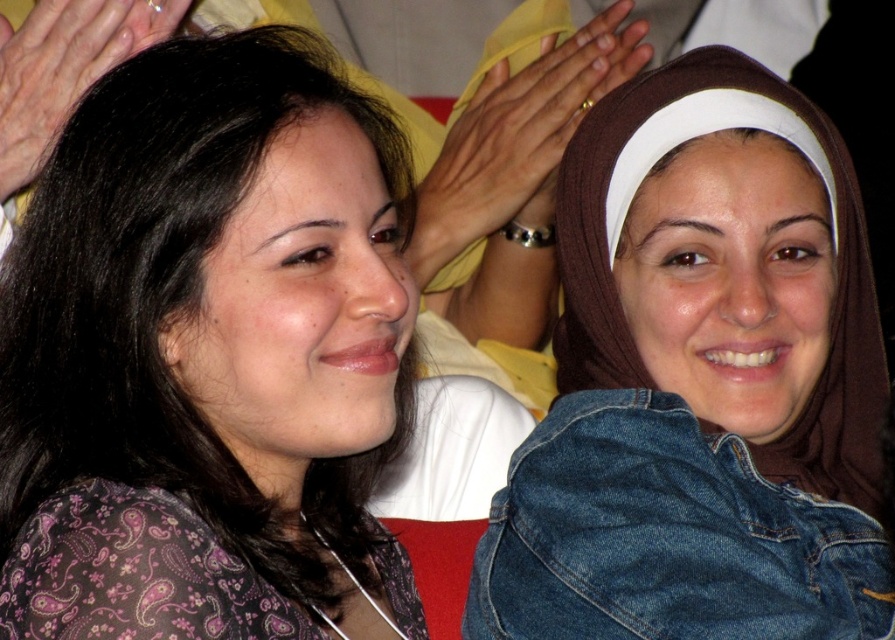
Question: Is paisley-patterned shirt at left to the left of metallic ring at upper center from the viewer's perspective?

Choices:
 (A) no
 (B) yes

Answer: (B)

Question: Can you confirm if brown denim jacket at upper right is positioned below paisley-patterned shirt at left?

Choices:
 (A) yes
 (B) no

Answer: (A)

Question: Which object is closer to the camera taking this photo?

Choices:
 (A) metallic ring at upper center
 (B) matte black hair at upper left
 (C) paisley-patterned shirt at left

Answer: (C)

Question: Which point is closer to the camera?

Choices:
 (A) (777, 564)
 (B) (109, 376)
 (C) (23, 115)
 (D) (424, 266)

Answer: (B)

Question: Does brown denim jacket at upper right appear under matte black hair at upper left?

Choices:
 (A) yes
 (B) no

Answer: (A)

Question: Which object is positioned closest to the brown denim jacket at upper right?

Choices:
 (A) metallic ring at upper center
 (B) matte black hair at upper left
 (C) paisley-patterned shirt at left

Answer: (C)